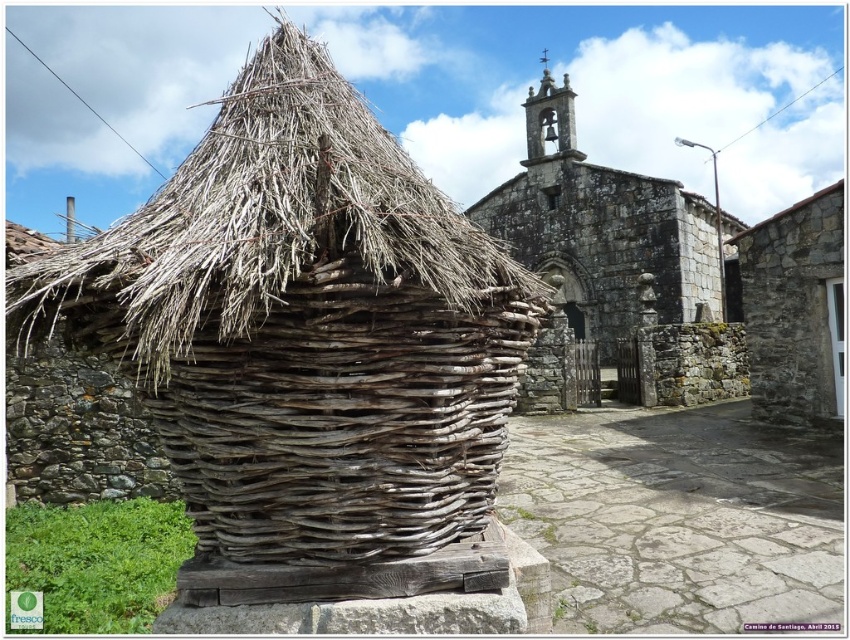
You are standing in the rustic scene and want to place a small potted plant on the brown woven basket at center. However, you need to ensure that the plant won not be directly exposed to rain. Based on the scene description, can you confirm if the dry straw roof at center provides shelter over the basket?

The brown woven basket at center is positioned under the dry straw roof at center, so the roof does provide shelter over the basket. This means the potted plant placed on the basket would be protected from direct rain exposure.